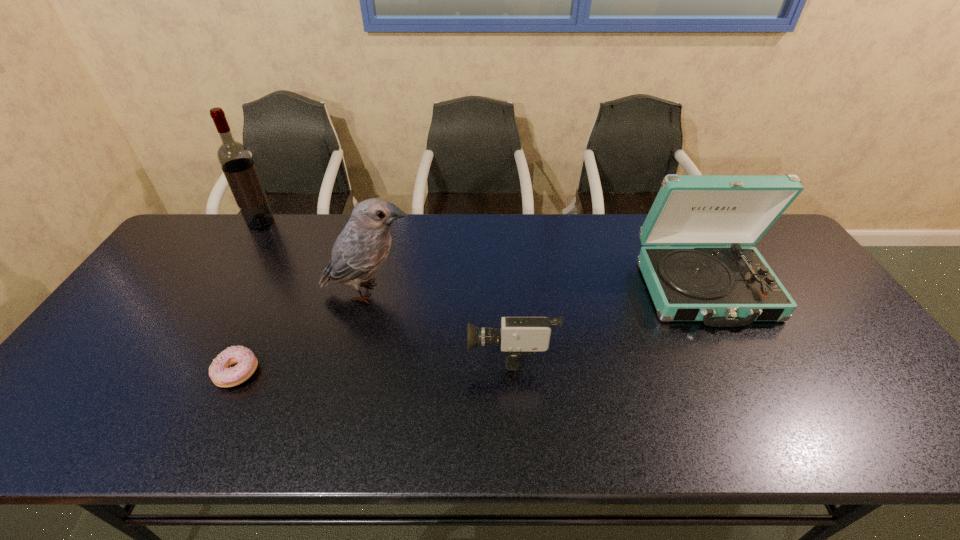
You are a GUI agent. You are given a task and a screenshot of the screen. Output one action in this format:
    pyautogui.click(x=<x>, y=<y>)
    Task: Click on the wine bottle
    The width and height of the screenshot is (960, 540).
    Given the screenshot: What is the action you would take?
    pyautogui.click(x=235, y=159)

I want to click on the leftmost object, so click(x=235, y=159).

The height and width of the screenshot is (540, 960). Find the location of `record player`. record player is located at coordinates (732, 286).

You are a GUI agent. You are given a task and a screenshot of the screen. Output one action in this format:
    pyautogui.click(x=<x>, y=<y>)
    Task: Click on the third object from left to right
    
    Given the screenshot: What is the action you would take?
    pyautogui.click(x=363, y=245)

This screenshot has width=960, height=540. Find the location of `camcorder`. camcorder is located at coordinates (518, 336).

Where is `the fourth tallest object`? the fourth tallest object is located at coordinates (518, 336).

What are the coordinates of `the second object from left to right` in the screenshot? It's located at (221, 371).

This screenshot has height=540, width=960. What are the coordinates of `doughnut` in the screenshot? It's located at (221, 371).

This screenshot has width=960, height=540. Find the location of `vacant space situated 0.150m on the front of the wine bottle`. vacant space situated 0.150m on the front of the wine bottle is located at coordinates (238, 260).

Identify the location of vacant space located 0.100m on the face side of the record player. Image resolution: width=960 pixels, height=540 pixels. (743, 361).